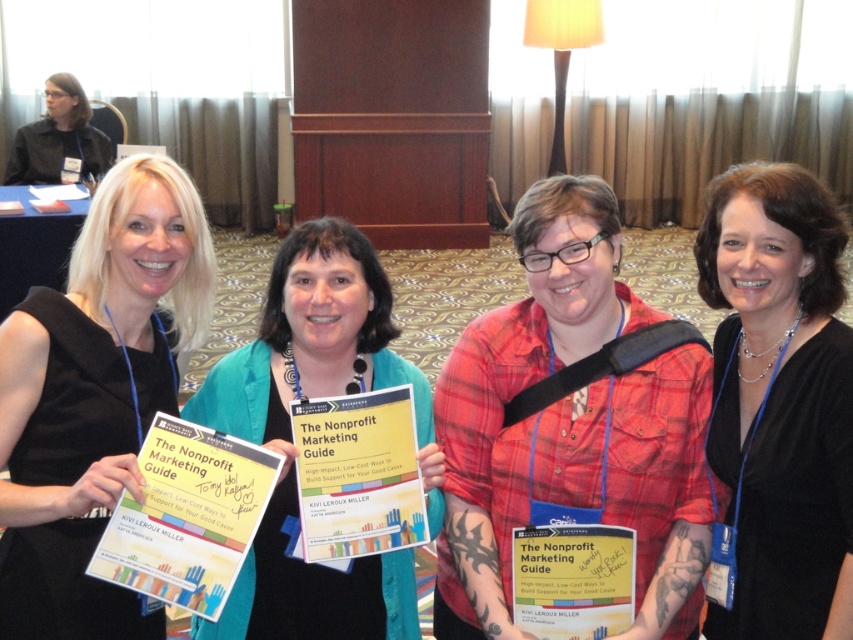
Question: Which point appears farthest from the camera in this image?

Choices:
 (A) (112, 467)
 (B) (793, 177)
 (C) (370, 346)

Answer: (C)

Question: Which object is positioned closest to the black fabric dress at left?

Choices:
 (A) teal fabric jacket at center
 (B) black fabric dress at lower right
 (C) red plaid shirt at center
 (D) matte black jacket at upper left

Answer: (A)

Question: Does black fabric dress at left appear over matte black jacket at upper left?

Choices:
 (A) yes
 (B) no

Answer: (B)

Question: Which point is closer to the camera?

Choices:
 (A) black fabric dress at left
 (B) matte black jacket at upper left

Answer: (A)

Question: Is black fabric dress at left above teal fabric jacket at center?

Choices:
 (A) no
 (B) yes

Answer: (B)

Question: Is red plaid shirt at center to the left of matte black jacket at upper left from the viewer's perspective?

Choices:
 (A) no
 (B) yes

Answer: (A)